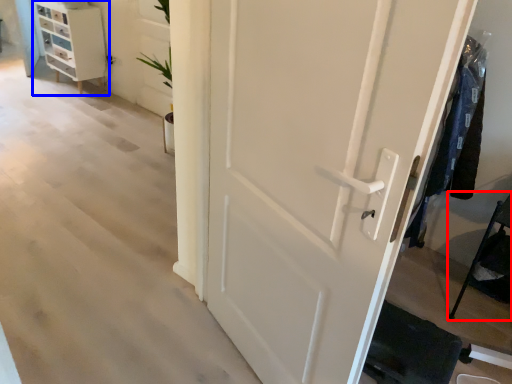
Question: Which object is closer to the camera taking this photo, furniture (highlighted by a red box) or chest of drawers (highlighted by a blue box)?

Choices:
 (A) furniture
 (B) chest of drawers

Answer: (A)